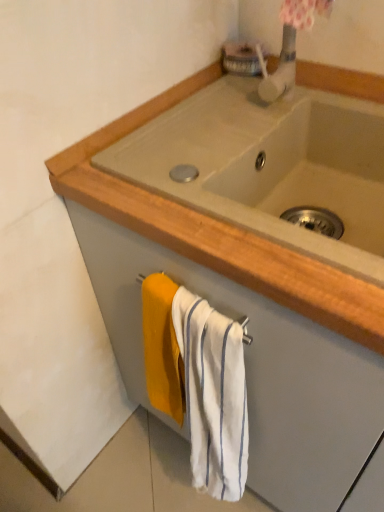
Question: Is white striped towel at lower center wider than beige ceramic sink at center?

Choices:
 (A) no
 (B) yes

Answer: (A)

Question: Does white striped towel at lower center lie behind beige ceramic sink at center?

Choices:
 (A) no
 (B) yes

Answer: (B)

Question: Can you confirm if white striped towel at lower center is thinner than beige ceramic sink at center?

Choices:
 (A) no
 (B) yes

Answer: (B)

Question: Is white striped towel at lower center at the right side of beige ceramic sink at center?

Choices:
 (A) no
 (B) yes

Answer: (A)

Question: From a real-world perspective, is white striped towel at lower center on top of beige ceramic sink at center?

Choices:
 (A) yes
 (B) no

Answer: (B)

Question: Is white striped towel at lower center bigger than beige ceramic sink at center?

Choices:
 (A) yes
 (B) no

Answer: (B)

Question: From the image's perspective, is beige ceramic sink at center on white striped towel at lower center?

Choices:
 (A) no
 (B) yes

Answer: (B)

Question: Is beige ceramic sink at center positioned beyond the bounds of white striped towel at lower center?

Choices:
 (A) yes
 (B) no

Answer: (A)

Question: Is beige ceramic sink at center looking in the opposite direction of white striped towel at lower center?

Choices:
 (A) no
 (B) yes

Answer: (A)

Question: Is beige ceramic sink at center aimed at white striped towel at lower center?

Choices:
 (A) yes
 (B) no

Answer: (B)

Question: Is white striped towel at lower center a part of beige ceramic sink at center?

Choices:
 (A) yes
 (B) no

Answer: (B)

Question: Does beige ceramic sink at center have a lesser height compared to white striped towel at lower center?

Choices:
 (A) yes
 (B) no

Answer: (A)

Question: Considering the relative positions of white striped towel at lower center and beige ceramic sink at center in the image provided, is white striped towel at lower center to the left or to the right of beige ceramic sink at center?

Choices:
 (A) right
 (B) left

Answer: (B)